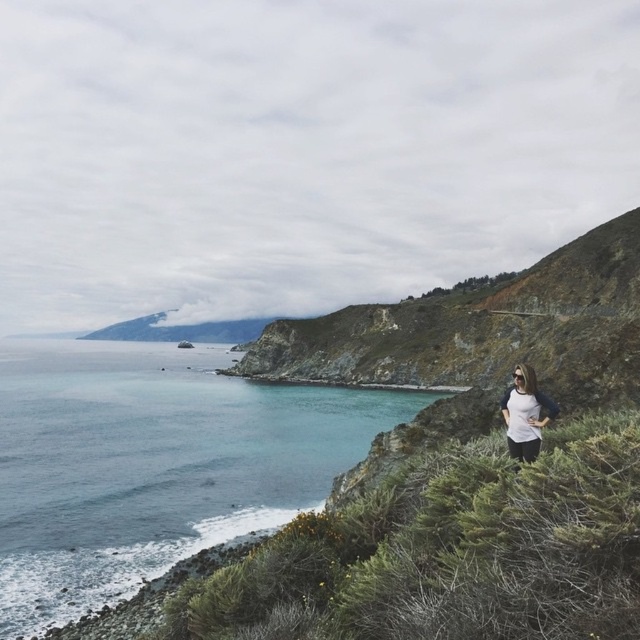
Does rocky cliff at center have a smaller size compared to white matte shirt at center?

Actually, rocky cliff at center might be larger than white matte shirt at center.

Between rocky cliff at center and white matte shirt at center, which one appears on the right side from the viewer's perspective?

rocky cliff at center is more to the right.

Where is `rocky cliff at center`? rocky cliff at center is located at coordinates (468, 323).

Is blue water at lower left further to the viewer compared to rocky cliff at center?

No, blue water at lower left is in front of rocky cliff at center.

Which of these two, blue water at lower left or rocky cliff at center, stands shorter?

Standing shorter between the two is blue water at lower left.

Which is in front, point (72, 372) or point (472, 340)?

Point (472, 340) is in front.

At what (x,y) coordinates should I click in order to perform the action: click on blue water at lower left. Please return your answer as a coordinate pair (x, y). Looking at the image, I should click on (152, 464).

Can you confirm if blue water at lower left is positioned to the left of white matte shirt at center?

Yes, blue water at lower left is to the left of white matte shirt at center.

You are a GUI agent. You are given a task and a screenshot of the screen. Output one action in this format:
    pyautogui.click(x=<x>, y=<y>)
    Task: Click on the blue water at lower left
    
    Given the screenshot: What is the action you would take?
    pyautogui.click(x=152, y=464)

Is point (20, 474) in front of point (513, 380)?

Yes, point (20, 474) is in front of point (513, 380).

This screenshot has height=640, width=640. Find the location of `blue water at lower left`. blue water at lower left is located at coordinates (152, 464).